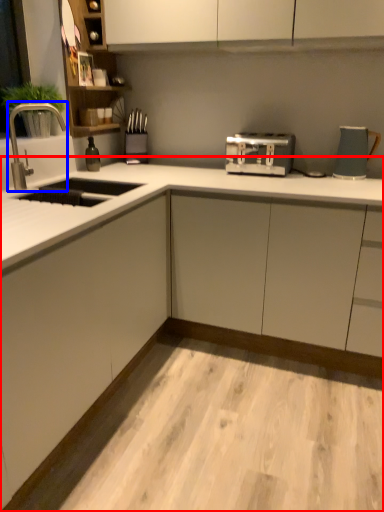
Question: Which object is closer to the camera taking this photo, countertop (highlighted by a red box) or tap (highlighted by a blue box)?

Choices:
 (A) countertop
 (B) tap

Answer: (A)